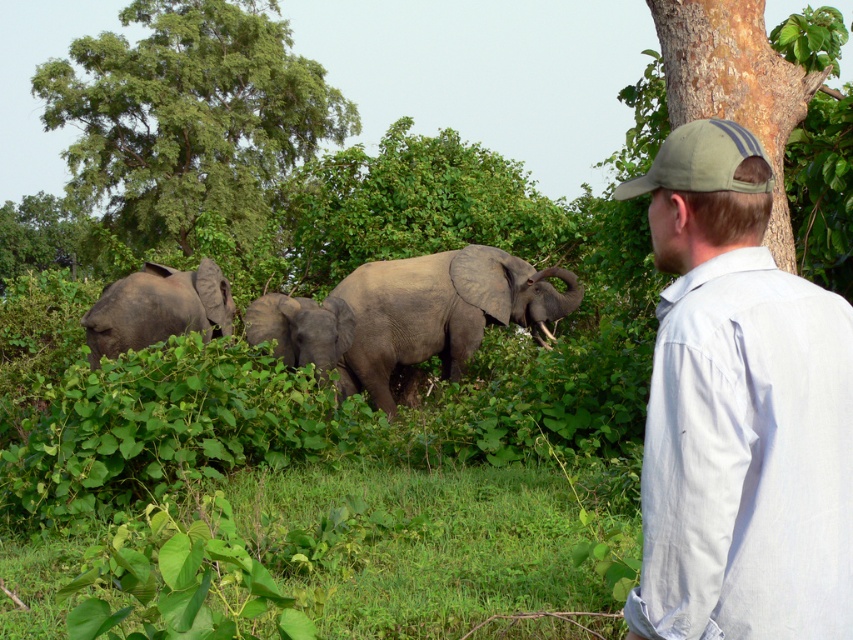
Question: Which object is farther from the camera taking this photo?

Choices:
 (A) gray matte elephant at left
 (B) gray matte baby elephant at center
 (C) smooth brown bark at upper right
 (D) gray matte elephant at center

Answer: (D)

Question: Which point is closer to the camera?

Choices:
 (A) (717, 100)
 (B) (654, 208)
 (C) (323, 348)

Answer: (B)

Question: Which object is the farthest from the gray matte elephant at center?

Choices:
 (A) gray matte elephant at left
 (B) gray matte baby elephant at center

Answer: (A)

Question: Is the position of gray matte elephant at center less distant than that of gray matte elephant at left?

Choices:
 (A) yes
 (B) no

Answer: (B)

Question: Is the position of light gray cotton shirt at upper right more distant than that of smooth brown bark at upper right?

Choices:
 (A) yes
 (B) no

Answer: (B)

Question: Considering the relative positions of green leafy tree at upper left and gray matte elephant at left in the image provided, where is green leafy tree at upper left located with respect to gray matte elephant at left?

Choices:
 (A) below
 (B) above

Answer: (B)